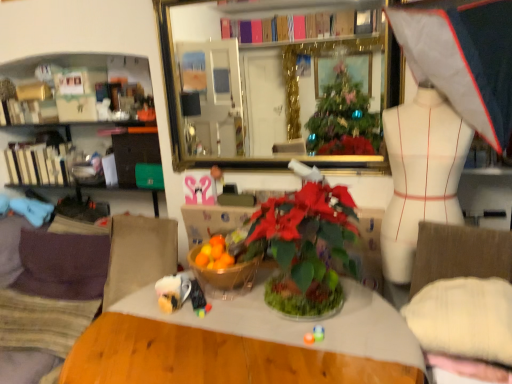
Question: Does green glossy houseplant at center have a lesser width compared to gold-framed mirror at upper center?

Choices:
 (A) yes
 (B) no

Answer: (B)

Question: From a real-world perspective, is green glossy houseplant at center located beneath gold-framed mirror at upper center?

Choices:
 (A) no
 (B) yes

Answer: (B)

Question: From the image's perspective, is green glossy houseplant at center located beneath gold-framed mirror at upper center?

Choices:
 (A) no
 (B) yes

Answer: (B)

Question: Considering the relative sizes of green glossy houseplant at center and gold-framed mirror at upper center in the image provided, is green glossy houseplant at center taller than gold-framed mirror at upper center?

Choices:
 (A) no
 (B) yes

Answer: (A)

Question: Could gold-framed mirror at upper center be considered to be inside green glossy houseplant at center?

Choices:
 (A) no
 (B) yes

Answer: (A)

Question: Is green glossy houseplant at center positioned behind gold-framed mirror at upper center?

Choices:
 (A) yes
 (B) no

Answer: (B)

Question: Is white matte mannequin at right with translucent glass bowl at center?

Choices:
 (A) no
 (B) yes

Answer: (A)

Question: Is white matte mannequin at right aimed at translucent glass bowl at center?

Choices:
 (A) no
 (B) yes

Answer: (A)

Question: Can you confirm if white matte mannequin at right is thinner than translucent glass bowl at center?

Choices:
 (A) yes
 (B) no

Answer: (A)

Question: From a real-world perspective, is white matte mannequin at right below translucent glass bowl at center?

Choices:
 (A) yes
 (B) no

Answer: (B)

Question: Does white matte mannequin at right have a smaller size compared to translucent glass bowl at center?

Choices:
 (A) no
 (B) yes

Answer: (A)

Question: Is white matte mannequin at right behind translucent glass bowl at center?

Choices:
 (A) no
 (B) yes

Answer: (A)

Question: Can you confirm if suede-like beige couch at lower left is positioned to the left of translucent glass bowl at center?

Choices:
 (A) yes
 (B) no

Answer: (A)